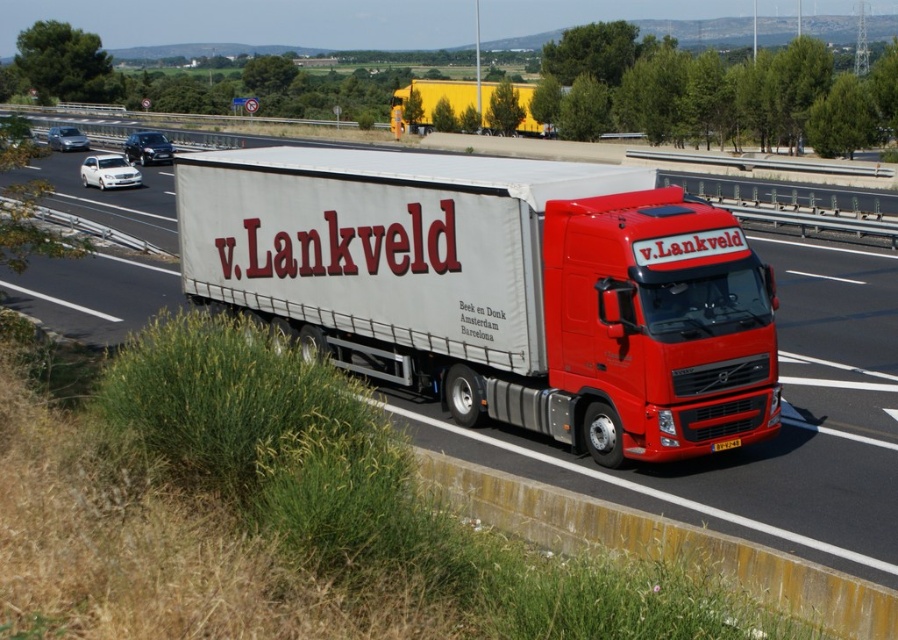
Question: Is white matte trailer truck at center thinner than yellow matte trailer at upper center?

Choices:
 (A) no
 (B) yes

Answer: (B)

Question: Is white matte trailer truck at center thinner than yellow matte trailer at upper center?

Choices:
 (A) no
 (B) yes

Answer: (B)

Question: Which point is closer to the camera?

Choices:
 (A) (461, 88)
 (B) (665, 362)

Answer: (B)

Question: Considering the relative positions of white matte trailer truck at center and yellow matte trailer at upper center in the image provided, where is white matte trailer truck at center located with respect to yellow matte trailer at upper center?

Choices:
 (A) below
 (B) above

Answer: (A)

Question: Which point is closer to the camera?

Choices:
 (A) yellow matte trailer at upper center
 (B) white matte trailer truck at center

Answer: (B)